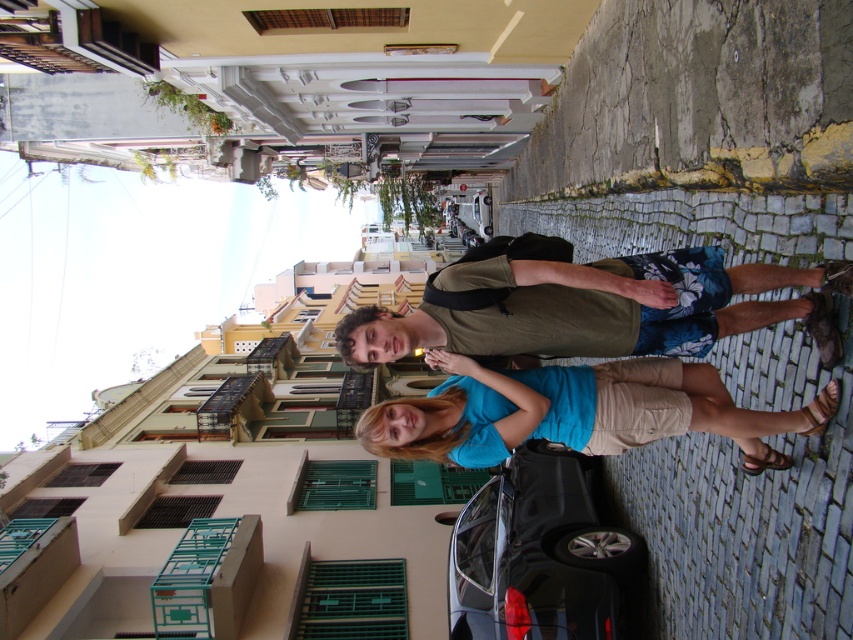
Question: Which object is the farthest from the green cotton shirt at center?

Choices:
 (A) blue cotton shirt at center
 (B) shiny black car at center

Answer: (B)

Question: Does green cotton shirt at center have a greater width compared to blue cotton shirt at center?

Choices:
 (A) yes
 (B) no

Answer: (B)

Question: Which of the following is the closest to the observer?

Choices:
 (A) green cotton shirt at center
 (B) blue cotton shirt at center

Answer: (A)

Question: Which is nearer to the green cotton shirt at center?

Choices:
 (A) shiny black car at center
 (B) blue cotton shirt at center

Answer: (B)

Question: Does green cotton shirt at center have a smaller size compared to blue cotton shirt at center?

Choices:
 (A) yes
 (B) no

Answer: (A)

Question: Can you confirm if blue cotton shirt at center is wider than shiny black car at center?

Choices:
 (A) yes
 (B) no

Answer: (A)